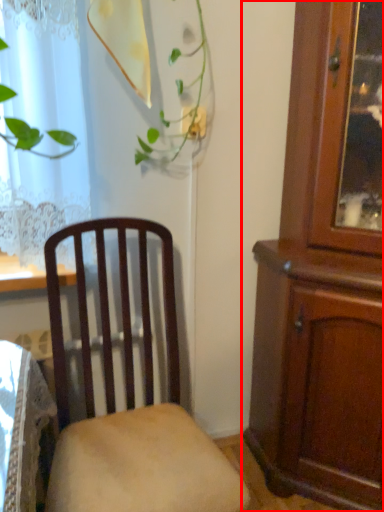
Question: From the image's perspective, considering the relative positions of cabinetry (annotated by the red box) and chair in the image provided, where is cabinetry (annotated by the red box) located with respect to the staircase?

Choices:
 (A) above
 (B) below

Answer: (A)